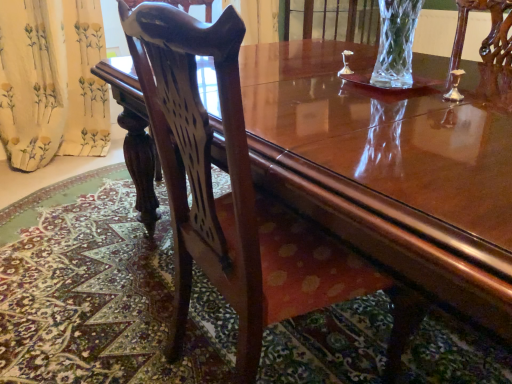
Question: Is yellow floral fabric at left to the left or to the right of mahogany wood chair at center in the image?

Choices:
 (A) right
 (B) left

Answer: (B)

Question: From their relative heights in the image, would you say yellow floral fabric at left is taller or shorter than mahogany wood chair at center?

Choices:
 (A) tall
 (B) short

Answer: (B)

Question: Is point (94, 6) closer or farther from the camera than point (244, 190)?

Choices:
 (A) closer
 (B) farther

Answer: (B)

Question: From a real-world perspective, is mahogany wood chair at center physically located above or below yellow floral fabric at left?

Choices:
 (A) below
 (B) above

Answer: (B)

Question: From the image's perspective, is mahogany wood chair at center above or below yellow floral fabric at left?

Choices:
 (A) below
 (B) above

Answer: (A)

Question: Does point (423, 307) appear closer or farther from the camera than point (49, 100)?

Choices:
 (A) farther
 (B) closer

Answer: (B)

Question: Do you think mahogany wood chair at center is within yellow floral fabric at left, or outside of it?

Choices:
 (A) outside
 (B) inside

Answer: (A)